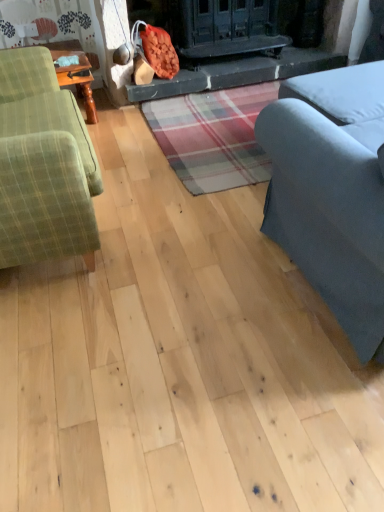
Question: From the image's perspective, would you say green plaid fabric couch at left, the 2th studio couch positioned from the right, is positioned over smooth stone fireplace at center?

Choices:
 (A) yes
 (B) no

Answer: (B)

Question: Is green plaid fabric couch at left, acting as the first studio couch starting from the left, next to smooth stone fireplace at center?

Choices:
 (A) no
 (B) yes

Answer: (A)

Question: From a real-world perspective, is green plaid fabric couch at left, acting as the first studio couch starting from the left, physically above smooth stone fireplace at center?

Choices:
 (A) no
 (B) yes

Answer: (B)

Question: Is green plaid fabric couch at left, the 2th studio couch positioned from the right, at the left side of smooth stone fireplace at center?

Choices:
 (A) no
 (B) yes

Answer: (B)

Question: Can you confirm if green plaid fabric couch at left, the 2th studio couch positioned from the right, is wider than smooth stone fireplace at center?

Choices:
 (A) yes
 (B) no

Answer: (B)

Question: Does green plaid fabric couch at left, the 2th studio couch positioned from the right, have a greater height compared to smooth stone fireplace at center?

Choices:
 (A) no
 (B) yes

Answer: (B)

Question: Is gray fabric couch at right, the 1th studio couch viewed from the right, facing towards smooth stone fireplace at center?

Choices:
 (A) no
 (B) yes

Answer: (B)

Question: Can you confirm if gray fabric couch at right, marked as the second studio couch in a left-to-right arrangement, is thinner than smooth stone fireplace at center?

Choices:
 (A) yes
 (B) no

Answer: (A)

Question: Considering the relative sizes of gray fabric couch at right, the 1th studio couch viewed from the right, and smooth stone fireplace at center in the image provided, is gray fabric couch at right, the 1th studio couch viewed from the right, taller than smooth stone fireplace at center?

Choices:
 (A) yes
 (B) no

Answer: (A)

Question: Is gray fabric couch at right, marked as the second studio couch in a left-to-right arrangement, positioned beyond the bounds of smooth stone fireplace at center?

Choices:
 (A) no
 (B) yes

Answer: (B)

Question: From a real-world perspective, is gray fabric couch at right, the 1th studio couch viewed from the right, physically above smooth stone fireplace at center?

Choices:
 (A) yes
 (B) no

Answer: (A)

Question: From the image's perspective, is gray fabric couch at right, the 1th studio couch viewed from the right, on smooth stone fireplace at center?

Choices:
 (A) no
 (B) yes

Answer: (A)

Question: Is green plaid fabric couch at left, the 2th studio couch positioned from the right, facing towards gray fabric couch at right, marked as the second studio couch in a left-to-right arrangement?

Choices:
 (A) no
 (B) yes

Answer: (B)